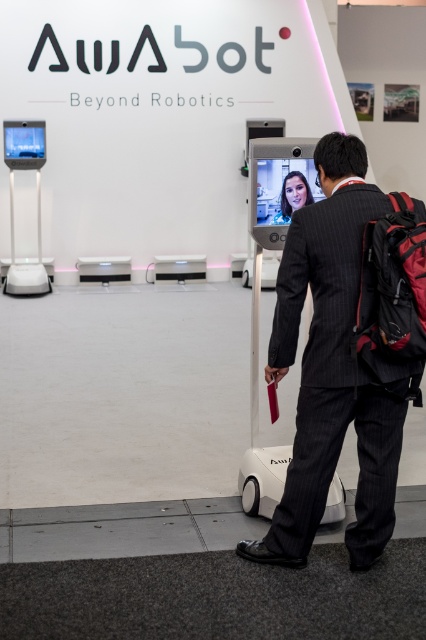
Question: Which point is closer to the camera taking this photo?

Choices:
 (A) (250, 556)
 (B) (271, 220)

Answer: (A)

Question: Which point is closer to the camera taking this photo?

Choices:
 (A) (321, 205)
 (B) (291, 209)

Answer: (A)

Question: Can you confirm if dark gray pinstripe suit at center is thinner than matte black screen at center?

Choices:
 (A) no
 (B) yes

Answer: (A)

Question: Is dark gray pinstripe suit at center wider than matte black screen at center?

Choices:
 (A) yes
 (B) no

Answer: (A)

Question: Is dark gray pinstripe suit at center positioned at the back of matte black screen at center?

Choices:
 (A) no
 (B) yes

Answer: (A)